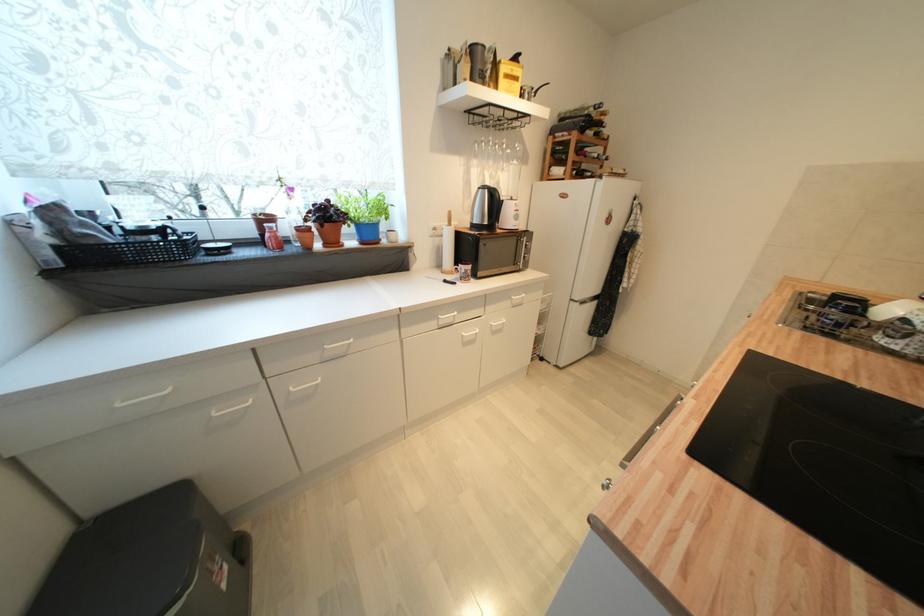
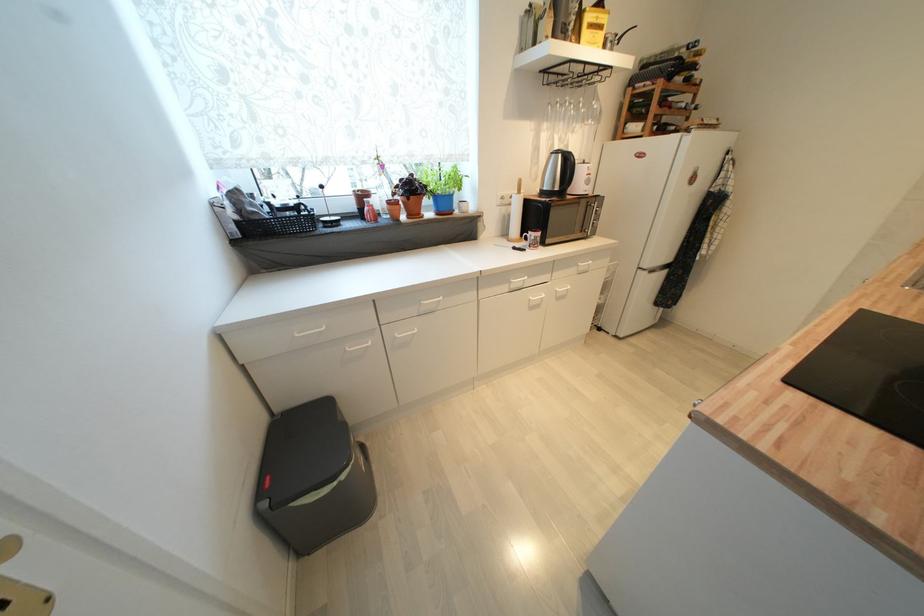
Question: I am providing you with two images of the same scene from different viewpoints. Please identify which objects are invisible in image2.

Choices:
 (A) refrigerator door handle
 (B) microwave door handle
 (C) blue plant pot
 (D) none of these

Answer: (D)